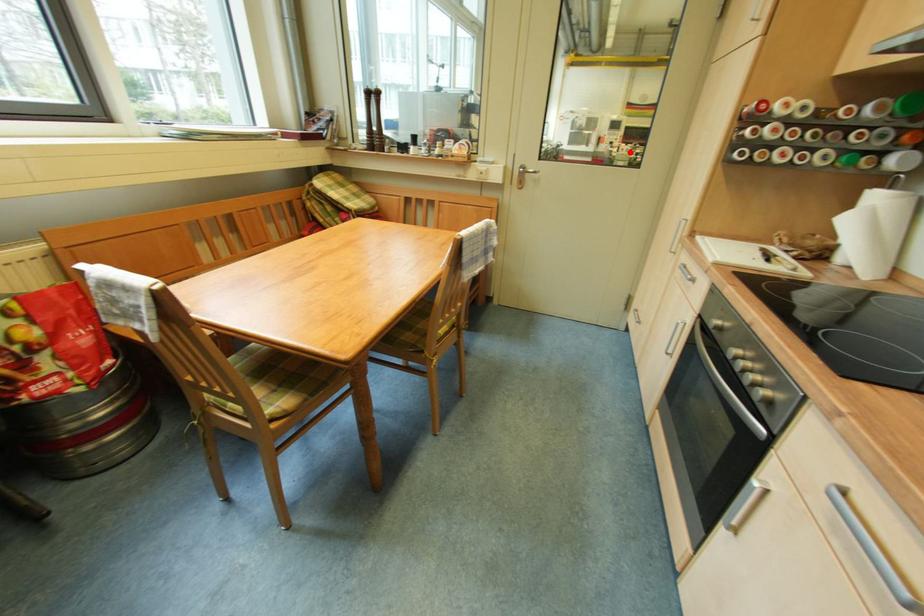
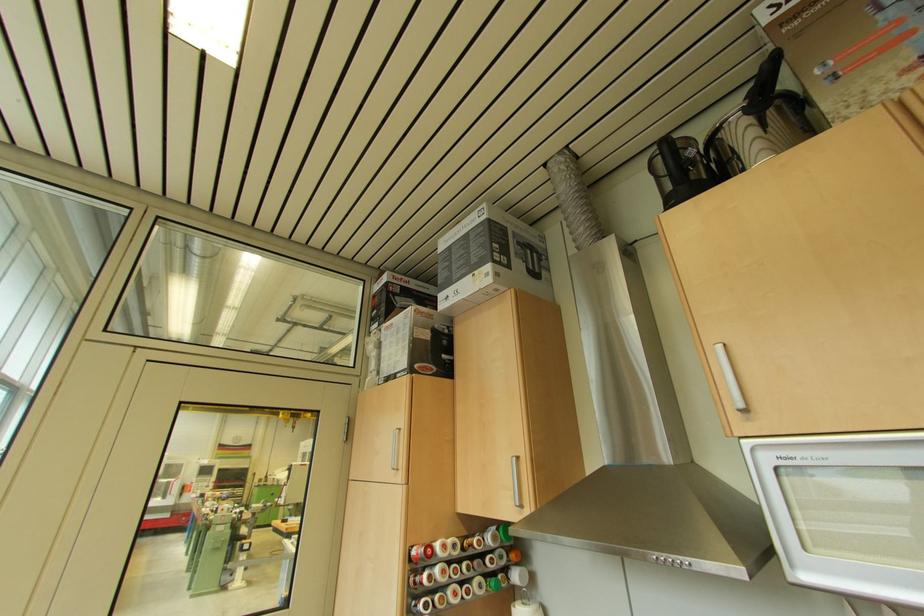
Where in the second image is the point corresponding to the highlighted location from the first image?

(229, 513)